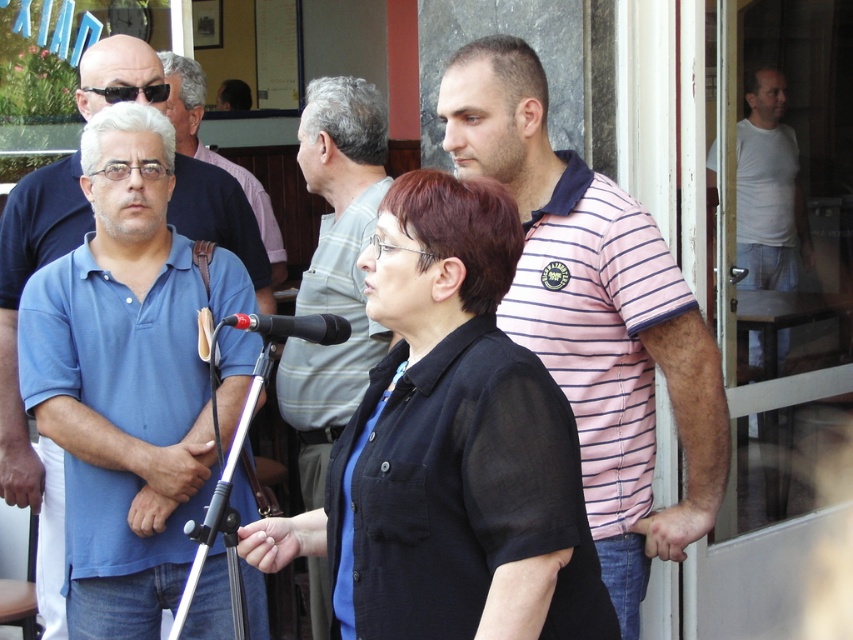
You are standing at the center of the scene and want to locate the blue cotton polo shirt at left. Which direction should you face to see it?

The blue cotton polo shirt at left is located at point (16, 356). Since the coordinate system is normalized, the x value of 0.558 places it to the right side of the image, so you should face to the right to locate it.

You are organizing an event and need to decide which of the two blue shirts to use for a speaker. The blue cotton polo shirt at left and the blue shirt at left are available. Which one is bigger?

The blue cotton polo shirt at left is larger in size compared to the blue shirt at left, so it would be the better choice for a speaker needing a bigger shirt.

You are organizing an event and need to place a 1.2 meter wide banner between the pink striped polo shirt at right and the black plastic microphone at center. Can the banner fit between them?

The pink striped polo shirt at right is wider than the black plastic microphone at center. However, the banner requires 1.2 meters of space between them. Without knowing the exact distance between the two objects, it is impossible to determine if the banner will fit.